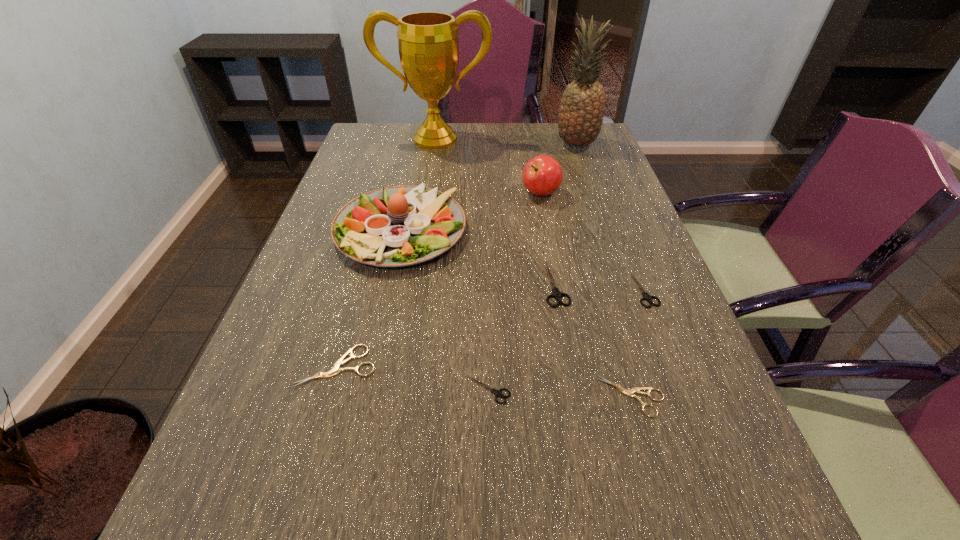
Where is `object that is positioned at the far right corner`? object that is positioned at the far right corner is located at coordinates (580, 118).

The image size is (960, 540). Find the location of `vacant space at the far edge of the desktop`. vacant space at the far edge of the desktop is located at coordinates (x=478, y=153).

Identify the location of vacant position at the left edge of the desktop. (300, 442).

The height and width of the screenshot is (540, 960). In order to click on vacant space at the right edge of the desktop in this screenshot , I will do `click(595, 219)`.

The height and width of the screenshot is (540, 960). In the image, there is a desktop. Identify the location of vacant space at the far left corner. (364, 141).

At what (x,y) coordinates should I click in order to perform the action: click on empty location between the leftmost shears and the fourth shears from left to right. Please return your answer as a coordinate pair (x, y). Looking at the image, I should click on (485, 381).

The width and height of the screenshot is (960, 540). I want to click on blank region between the bigger beige shears and the pineapple, so click(x=457, y=255).

At what (x,y) coordinates should I click in order to perform the action: click on free space that is in between the smallest black shears and the salad plate. Please return your answer as a coordinate pair (x, y). This screenshot has height=540, width=960. Looking at the image, I should click on (444, 310).

Identify the location of free point between the salad plate and the smaller beige shears. (516, 314).

Where is `empty space that is in between the smaller beige shears and the smallest black shears`? The image size is (960, 540). empty space that is in between the smaller beige shears and the smallest black shears is located at coordinates (560, 393).